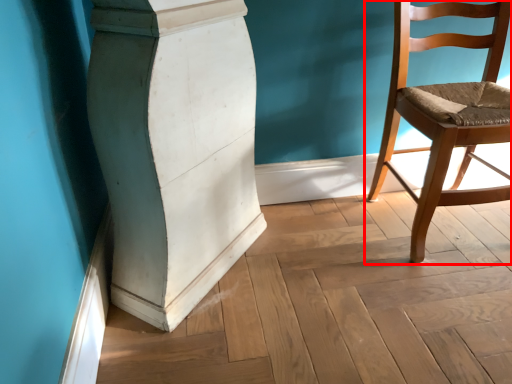
Question: From the image's perspective, what is the correct spatial relationship of chair (annotated by the red box) in relation to pillar?

Choices:
 (A) above
 (B) below

Answer: (A)